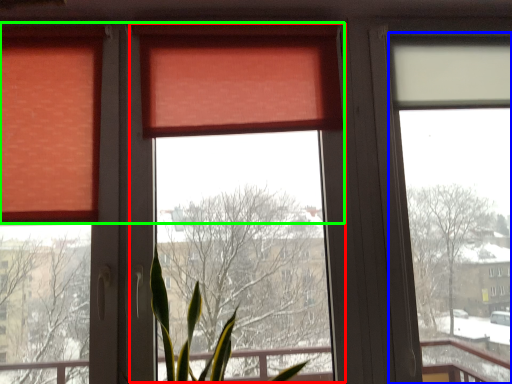
Question: Which object is positioned farthest from window screen (highlighted by a red box)? Select from window screen (highlighted by a blue box) and curtain (highlighted by a green box).

Choices:
 (A) window screen
 (B) curtain

Answer: (A)